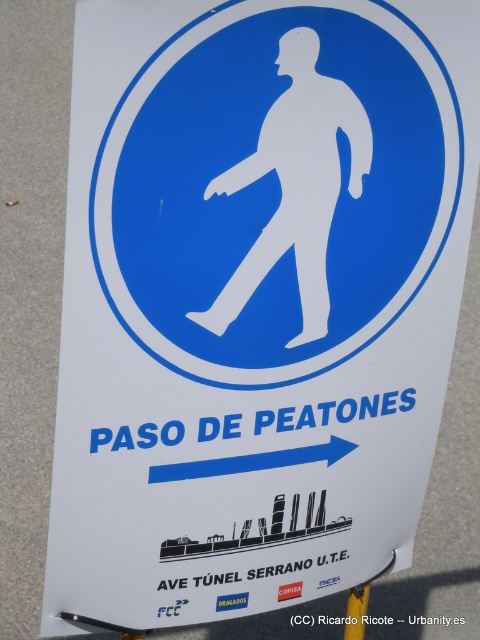
You are a pedestrian standing at the intersection and see the white matte figure at center and the yellow plastic pole at lower center. Which object is nearer to you?

The white matte figure at center is closer to the viewer than the yellow plastic pole at lower center.

Looking at this image, you are a pedestrian approaching the pedestrian crossing sign. You see the white matte figure at center and the yellow plastic pole at lower center. Which object is located to the left of the other?

The white matte figure at center is positioned on the left side of yellow plastic pole at lower center, so the white matte figure at center is to the left of the yellow plastic pole at lower center.

You are a delivery person with a 36 inch wide package. You need to carry it through the pedestrian crossing indicated by the white matte figure at center. Can you pass through without tilting the package? Please explain your reasoning based on the sign details.

The white matte figure at center is 35.52 inches away from the viewer. Since the package is 36 inches wide, it is slightly wider than the distance available, so you cannot pass through without tilting the package.